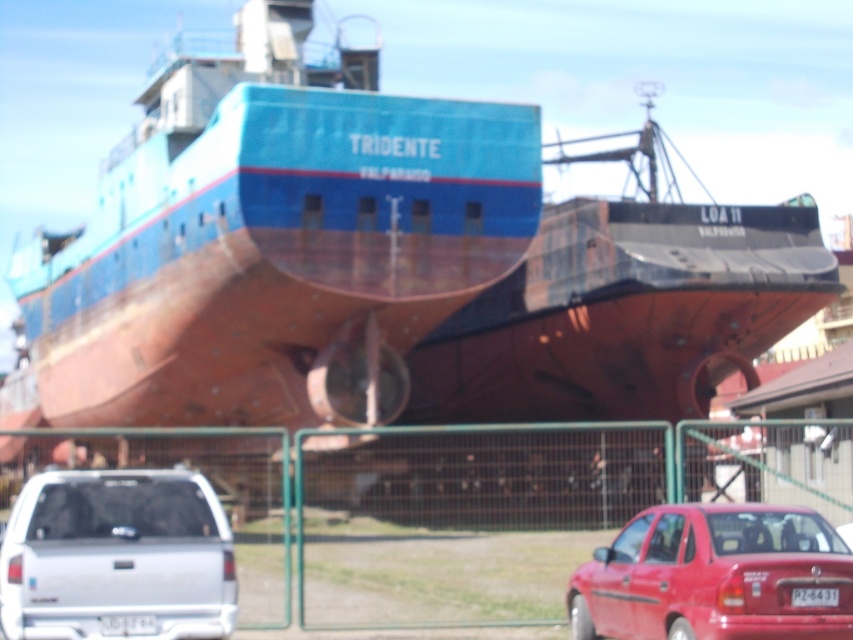
Is shiny red sedan at lower right further to the viewer compared to white plastic license plate at lower center?

That is False.

Does shiny red sedan at lower right appear on the left side of white plastic license plate at lower center?

Incorrect, shiny red sedan at lower right is not on the left side of white plastic license plate at lower center.

Between point (773, 605) and point (128, 630), which one is positioned in front?

Positioned in front is point (773, 605).

Image resolution: width=853 pixels, height=640 pixels. I want to click on shiny red sedan at lower right, so click(712, 576).

Is silver metallic pickup truck at lower left wider than white plastic license plate at lower center?

Yes.

Can you confirm if silver metallic pickup truck at lower left is smaller than white plastic license plate at lower center?

Incorrect, silver metallic pickup truck at lower left is not smaller in size than white plastic license plate at lower center.

Describe the element at coordinates (115, 556) in the screenshot. I see `silver metallic pickup truck at lower left` at that location.

Locate an element on the screen. Image resolution: width=853 pixels, height=640 pixels. silver metallic pickup truck at lower left is located at coordinates (115, 556).

Is white plastic license plate at lower center to the left of white plastic license plate at center from the viewer's perspective?

Correct, you'll find white plastic license plate at lower center to the left of white plastic license plate at center.

Who is more distant from viewer, (152, 632) or (808, 602)?

The point (152, 632) is behind.

I want to click on white plastic license plate at lower center, so click(x=126, y=625).